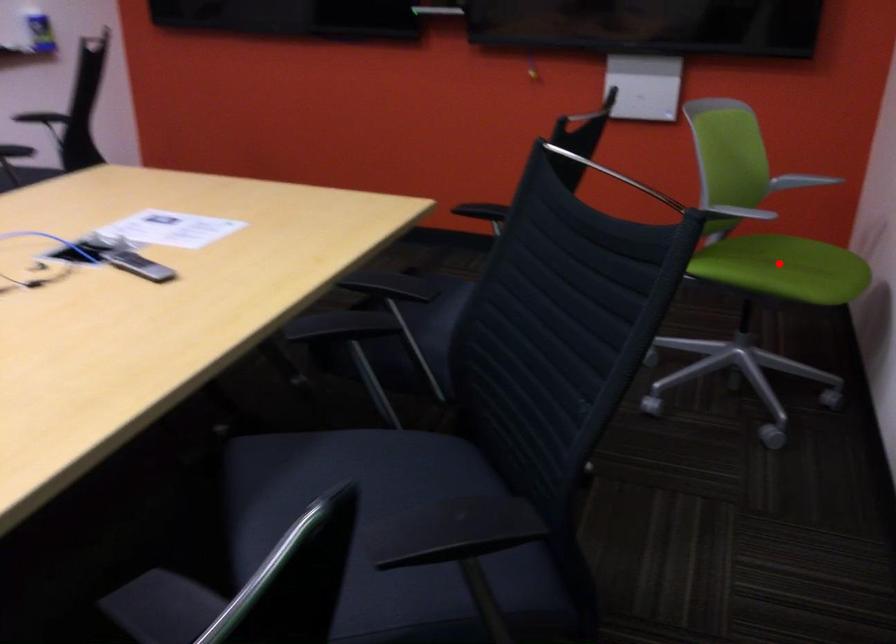
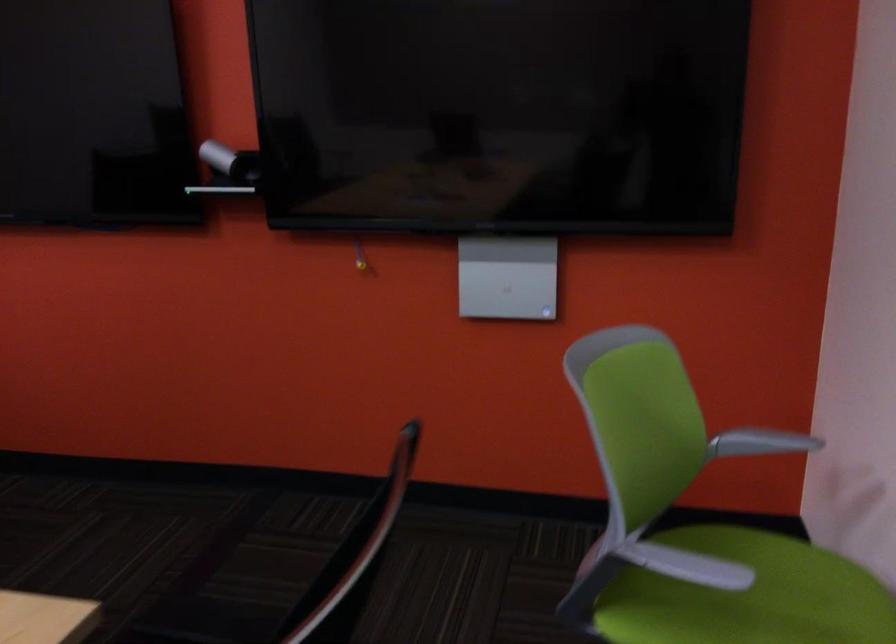
In the second image, find the point that corresponds to the highlighted location in the first image.

(747, 596)